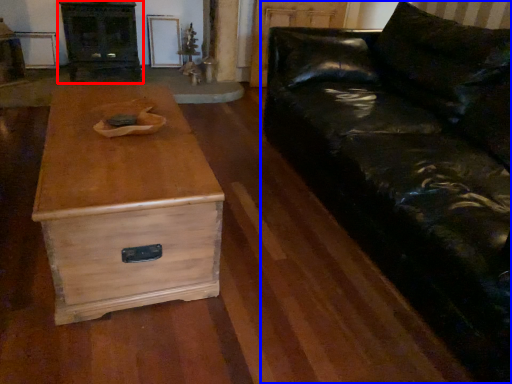
Question: Which object appears farthest to the camera in this image, entertainment center (highlighted by a red box) or studio couch (highlighted by a blue box)?

Choices:
 (A) entertainment center
 (B) studio couch

Answer: (A)